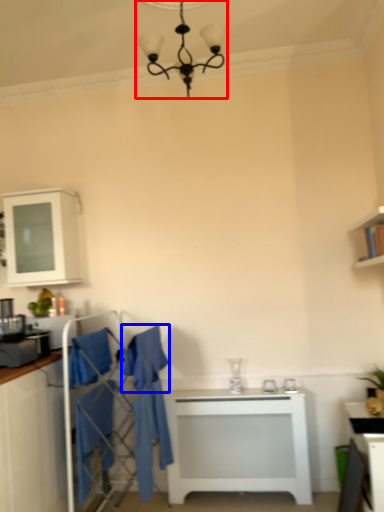
Question: Among these objects, which one is nearest to the camera, light fixture (highlighted by a red box) or robe (highlighted by a blue box)?

Choices:
 (A) light fixture
 (B) robe

Answer: (A)